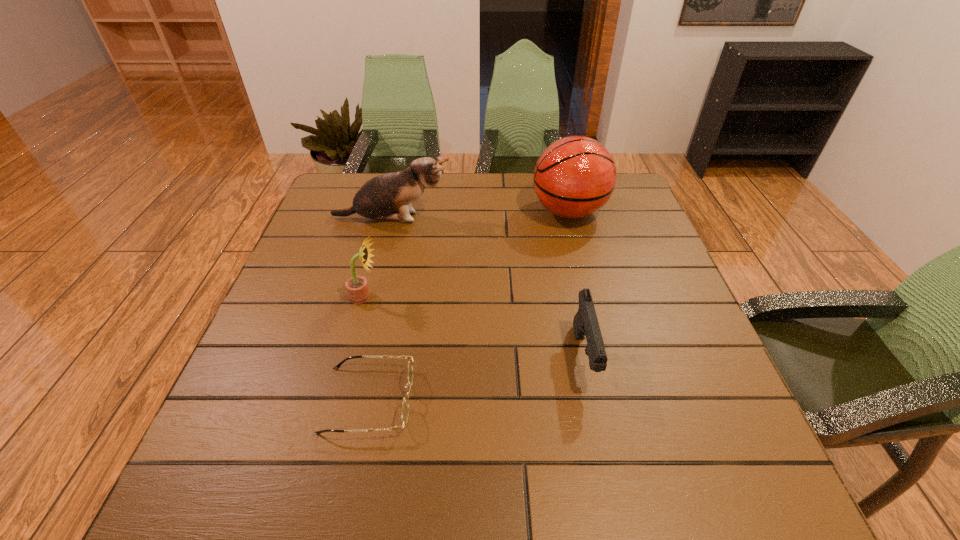
I want to click on the tallest object, so click(574, 177).

The width and height of the screenshot is (960, 540). What are the coordinates of `cat` in the screenshot? It's located at (388, 196).

This screenshot has width=960, height=540. I want to click on sunflower, so 357,288.

Where is `the fourth tallest object`? This screenshot has width=960, height=540. the fourth tallest object is located at coordinates (585, 323).

Locate an element on the screen. The width and height of the screenshot is (960, 540). spectacles is located at coordinates (405, 405).

Identify the location of vacant space situated 0.170m on the side with spill of the basketball. (472, 212).

The image size is (960, 540). What are the coordinates of `blank area located 0.190m on the side with spill of the basketball` in the screenshot? It's located at (466, 212).

Locate an element on the screen. Image resolution: width=960 pixels, height=540 pixels. vacant space located on the side with spill of the basketball is located at coordinates pyautogui.click(x=444, y=212).

Find the location of `free point located 0.240m at the face of the cat`. free point located 0.240m at the face of the cat is located at coordinates (536, 219).

The image size is (960, 540). In order to click on vacant space located on the face of the third farthest object in this screenshot , I will do `click(401, 296)`.